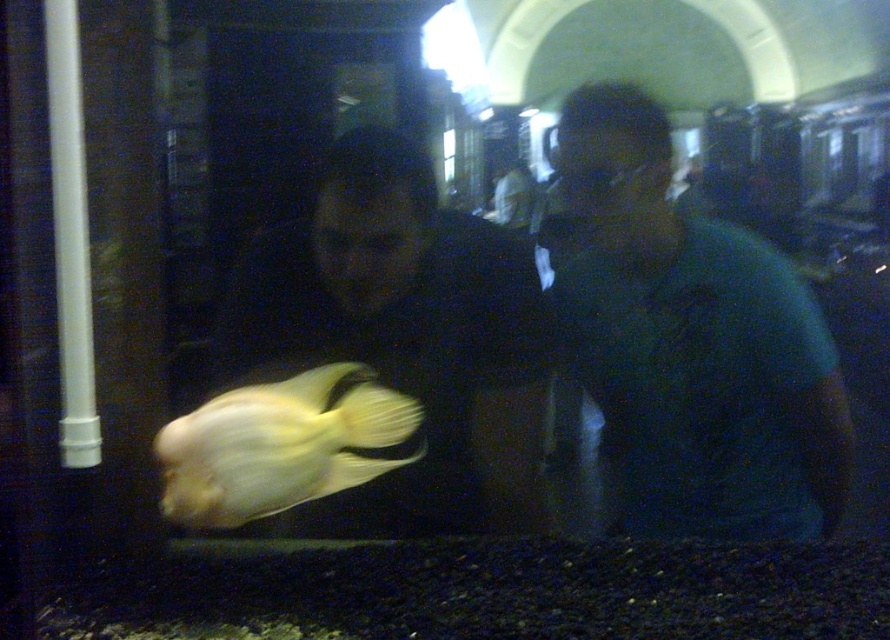
You are a visitor in the museum and see both the green matte shirt at center and the translucent yellow fish at center. Which object is positioned to the right side?

The green matte shirt at center is positioned to the right of the translucent yellow fish at center.

You are a photographer trying to capture a clear photo of the translucent yellow fish at center without the green matte shirt at center blocking the view. Can you adjust your position to do so?

The green matte shirt at center is further to the viewer than the translucent yellow fish at center, so moving your position to the side or adjusting the angle might allow you to capture the fish without the shirt blocking the view.